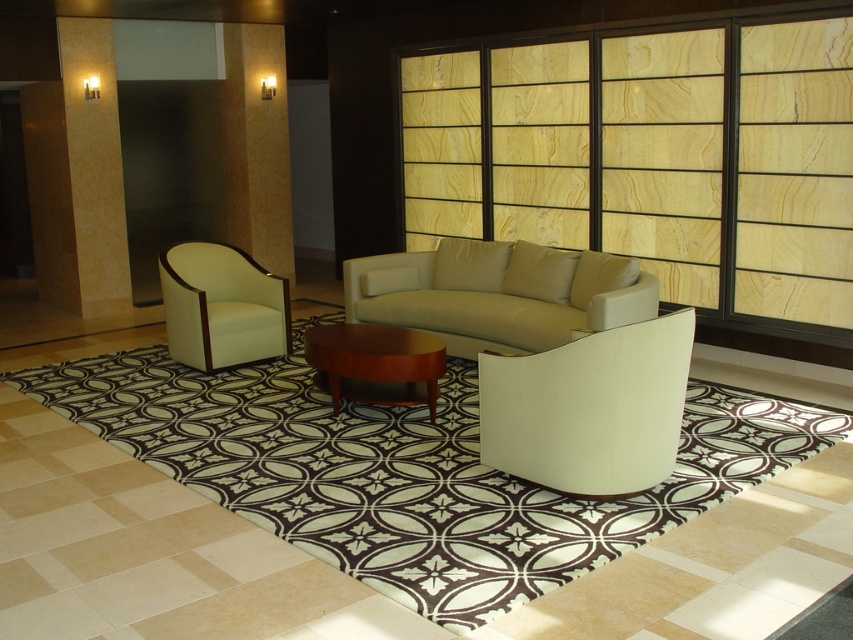
Question: Among these points, which one is nearest to the camera?

Choices:
 (A) (527, 332)
 (B) (195, 257)
 (C) (538, 362)
 (D) (368, 342)

Answer: (C)

Question: Is beige leather couch at center closer to camera compared to white leather armchair at left?

Choices:
 (A) yes
 (B) no

Answer: (A)

Question: Which of the following is the farthest from the observer?

Choices:
 (A) white leather armchair at left
 (B) white leather chair at center
 (C) beige leather couch at center

Answer: (A)

Question: Is white leather chair at center smaller than mahogany wood coffee table at center?

Choices:
 (A) no
 (B) yes

Answer: (A)

Question: Which of the following is the farthest from the observer?

Choices:
 (A) white leather chair at center
 (B) beige leather couch at center

Answer: (B)

Question: Does beige leather couch at center have a smaller size compared to mahogany wood coffee table at center?

Choices:
 (A) yes
 (B) no

Answer: (B)